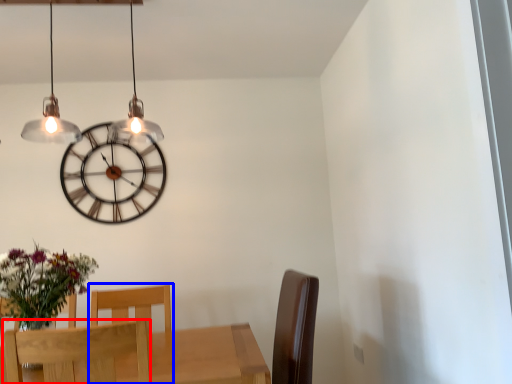
Question: Which object is closer to the camera taking this photo, chair (highlighted by a red box) or chair (highlighted by a blue box)?

Choices:
 (A) chair
 (B) chair

Answer: (A)